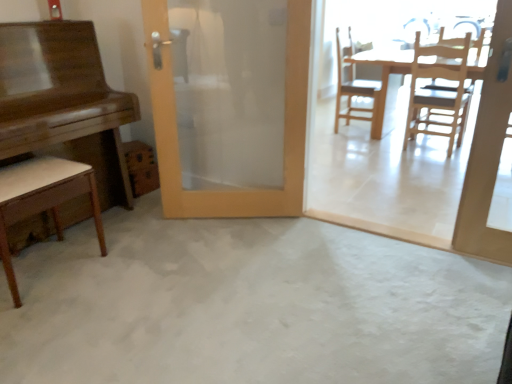
Find the location of `free space on the front side of wooden chair at right, the 3th chair from the left`. free space on the front side of wooden chair at right, the 3th chair from the left is located at coordinates (426, 163).